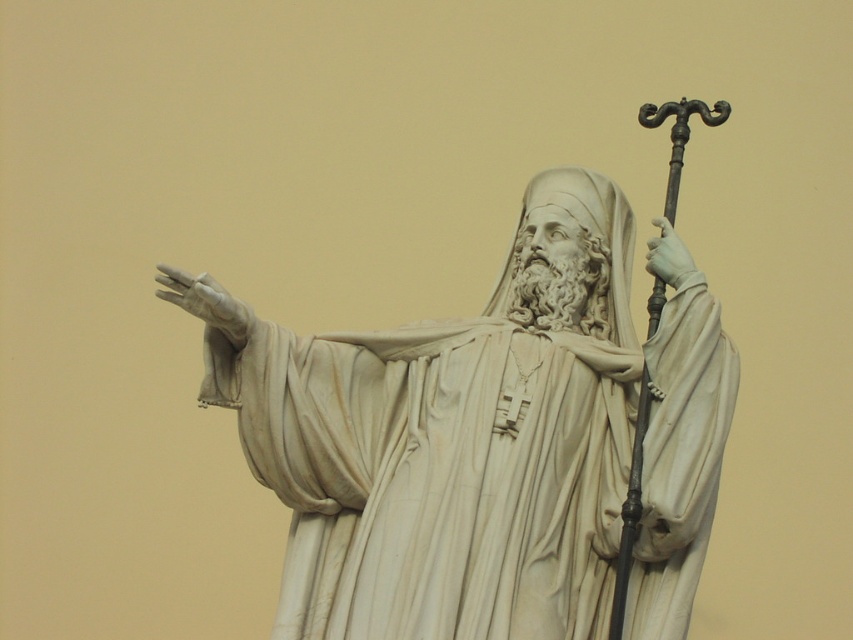
Question: Does white marble statue at center have a smaller size compared to white marble hand at center-left?

Choices:
 (A) yes
 (B) no

Answer: (B)

Question: Can you confirm if white marble hand at center-left is wider than white marble hand at center-right?

Choices:
 (A) no
 (B) yes

Answer: (A)

Question: Estimate the real-world distances between objects in this image. Which object is closer to the white marble hand at center-right?

Choices:
 (A) white marble hand at center-left
 (B) white marble statue at center

Answer: (B)

Question: Which point is farther to the camera?

Choices:
 (A) white marble hand at center-right
 (B) white marble statue at center
 (C) white marble hand at center-left

Answer: (A)

Question: Is white marble statue at center closer to camera compared to white marble hand at center-right?

Choices:
 (A) no
 (B) yes

Answer: (B)

Question: Which of the following is the closest to the observer?

Choices:
 (A) (177, 300)
 (B) (556, 634)

Answer: (B)